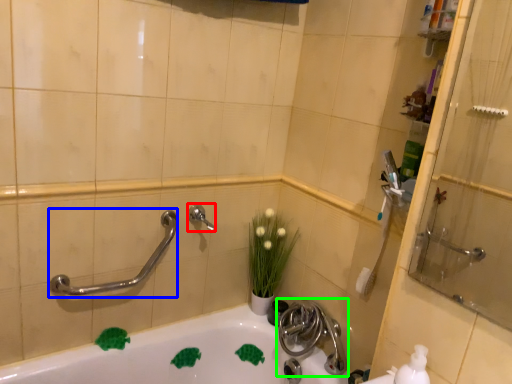
Question: Considering the real-world distances, which object is closest to plumbing fixture (highlighted by a red box)? shower (highlighted by a blue box) or tap (highlighted by a green box).

Choices:
 (A) shower
 (B) tap

Answer: (A)